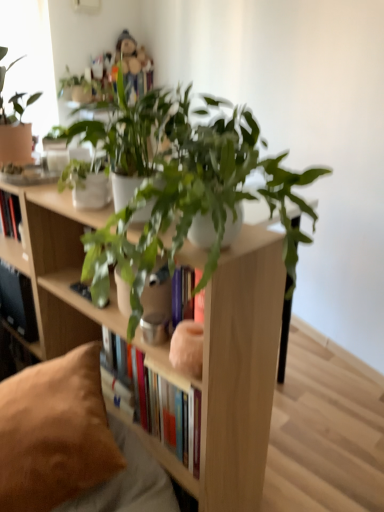
Question: From a real-world perspective, is green matte plant at center, which is counted as the 1th houseplant, starting from the back, located beneath black matte shelf at lower left?

Choices:
 (A) yes
 (B) no

Answer: (B)

Question: Considering the relative sizes of green matte plant at center, which is counted as the 1th houseplant, starting from the back, and black matte shelf at lower left in the image provided, is green matte plant at center, which is counted as the 1th houseplant, starting from the back, bigger than black matte shelf at lower left?

Choices:
 (A) no
 (B) yes

Answer: (B)

Question: From a real-world perspective, is green matte plant at center, the second houseplant from the front, located higher than black matte shelf at lower left?

Choices:
 (A) no
 (B) yes

Answer: (B)

Question: Could you tell me if green matte plant at center, the second houseplant from the front, is turned towards black matte shelf at lower left?

Choices:
 (A) no
 (B) yes

Answer: (A)

Question: Is black matte shelf at lower left surrounded by green matte plant at center, the second houseplant from the front?

Choices:
 (A) no
 (B) yes

Answer: (A)

Question: Can you confirm if green matte plant at center, which is counted as the 1th houseplant, starting from the back, is positioned to the right of black matte shelf at lower left?

Choices:
 (A) no
 (B) yes

Answer: (B)

Question: Does green matte plant at upper center, the 1th houseplant when ordered from front to back, have a greater width compared to brown suede pillow at lower left?

Choices:
 (A) no
 (B) yes

Answer: (A)

Question: Is green matte plant at upper center, the 1th houseplant when ordered from front to back, not near brown suede pillow at lower left?

Choices:
 (A) yes
 (B) no

Answer: (B)

Question: Is green matte plant at upper center, marked as the second houseplant in a back-to-front arrangement, positioned before brown suede pillow at lower left?

Choices:
 (A) yes
 (B) no

Answer: (A)

Question: Does green matte plant at upper center, the 1th houseplant when ordered from front to back, have a greater height compared to brown suede pillow at lower left?

Choices:
 (A) yes
 (B) no

Answer: (A)

Question: From a real-world perspective, is green matte plant at upper center, marked as the second houseplant in a back-to-front arrangement, on brown suede pillow at lower left?

Choices:
 (A) yes
 (B) no

Answer: (A)

Question: Does green matte plant at upper center, marked as the second houseplant in a back-to-front arrangement, touch brown suede pillow at lower left?

Choices:
 (A) no
 (B) yes

Answer: (A)

Question: From the image's perspective, is black matte shelf at lower left above green matte plant at center, the second houseplant from the front?

Choices:
 (A) yes
 (B) no

Answer: (B)